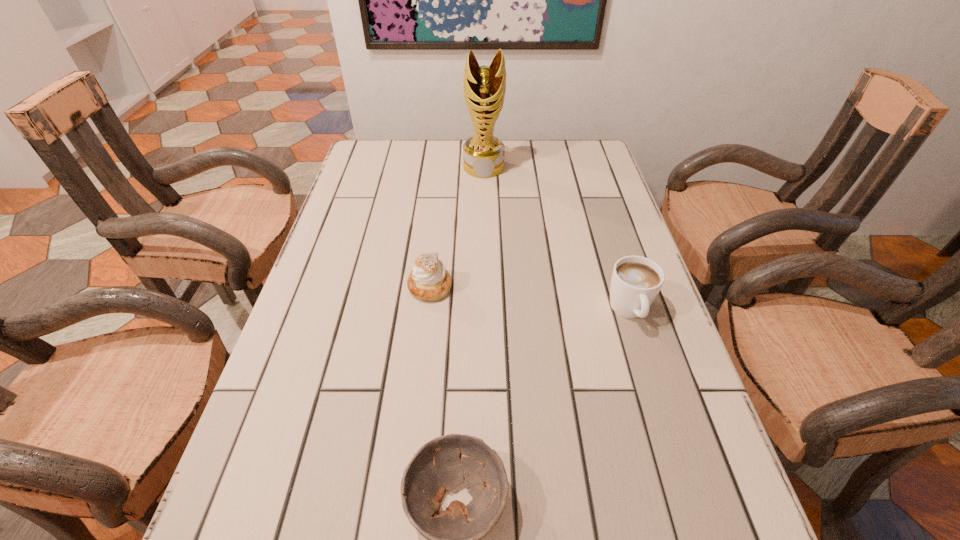
You are a GUI agent. You are given a task and a screenshot of the screen. Output one action in this format:
    pyautogui.click(x=<x>, y=<y>)
    Task: Click on the free region at the right edge
    
    Given the screenshot: What is the action you would take?
    pyautogui.click(x=613, y=186)

Locate an element on the screen. vacant space at the far left corner of the desktop is located at coordinates (400, 160).

What are the coordinates of `vacant space at the far right corner of the desktop` in the screenshot? It's located at (591, 158).

The height and width of the screenshot is (540, 960). Find the location of `vacant space in between the award and the cappuccino`. vacant space in between the award and the cappuccino is located at coordinates (557, 239).

At what (x,y) coordinates should I click in order to perform the action: click on blank region between the tallest object and the rightmost object. Please return your answer as a coordinate pair (x, y). The height and width of the screenshot is (540, 960). Looking at the image, I should click on (557, 239).

Locate an element on the screen. The height and width of the screenshot is (540, 960). vacant space that is in between the rightmost object and the award is located at coordinates (557, 239).

I want to click on vacant point located between the pastry and the cappuccino, so click(x=530, y=299).

The image size is (960, 540). I want to click on free space between the rightmost object and the pastry, so click(x=530, y=299).

Locate an element on the screen. The width and height of the screenshot is (960, 540). free area in between the farthest object and the rightmost object is located at coordinates (557, 239).

I want to click on object that is the third closest one to the tallest object, so click(x=453, y=536).